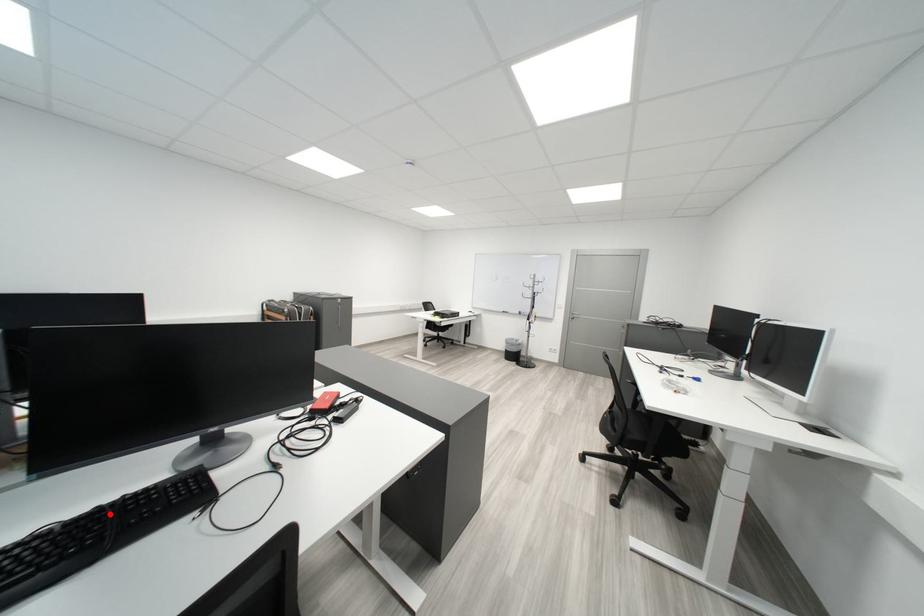
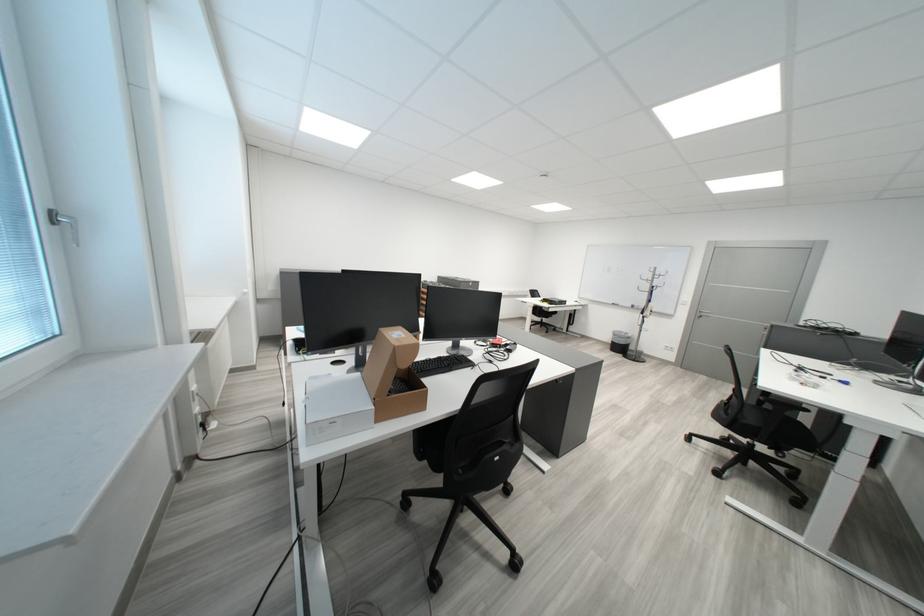
Where in the second image is the point corresponding to the highlighted location from the first image?

(453, 360)